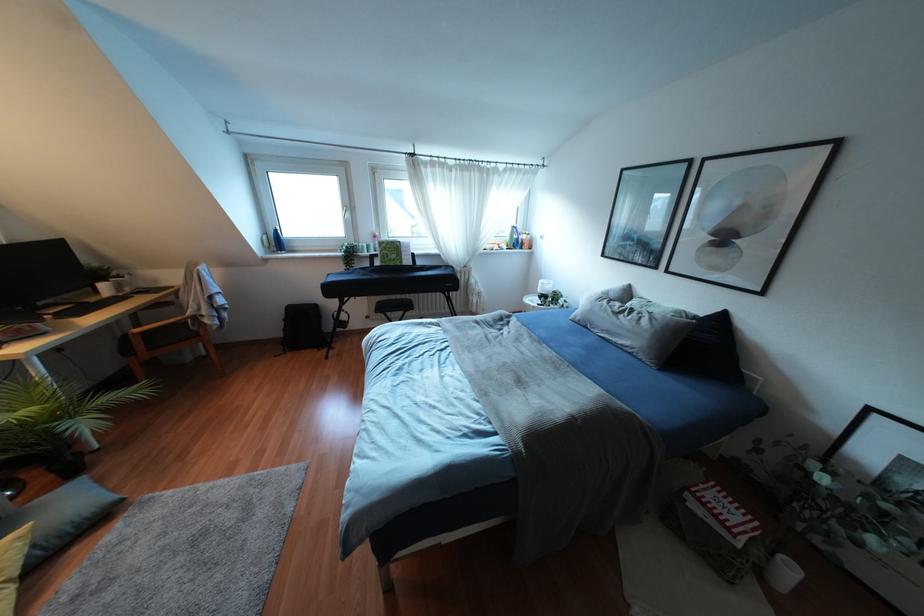
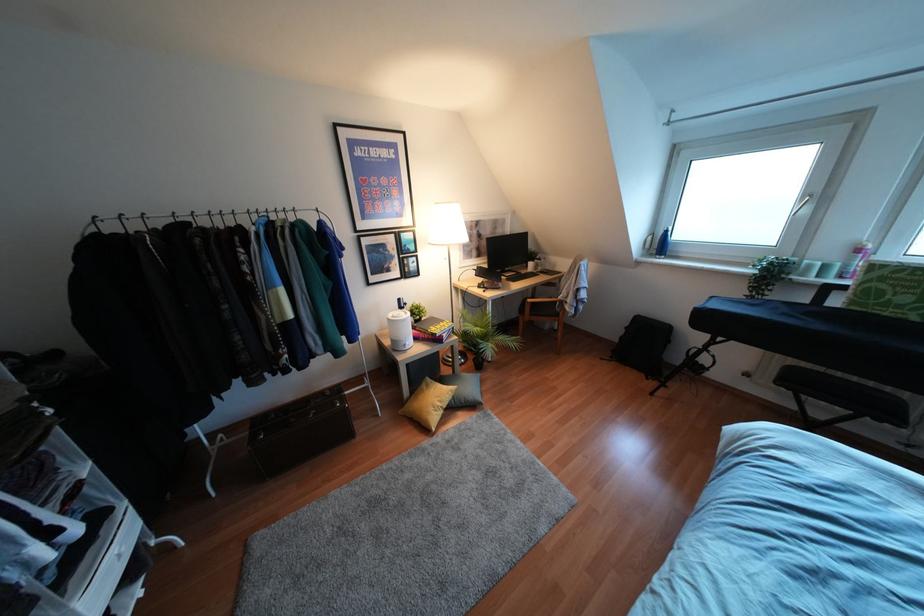
In the second image, find the point that corresponds to the point at 367,246 in the first image.

(824, 267)